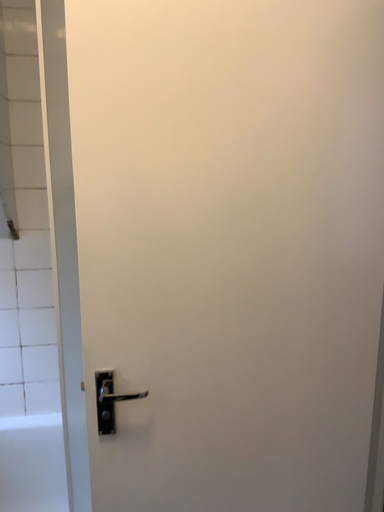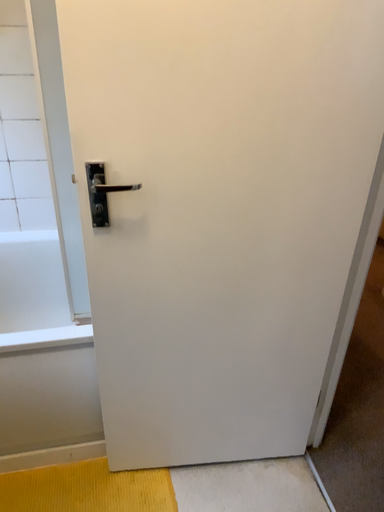
Question: Which way did the camera rotate in the video?

Choices:
 (A) rotated downward
 (B) rotated upward

Answer: (A)